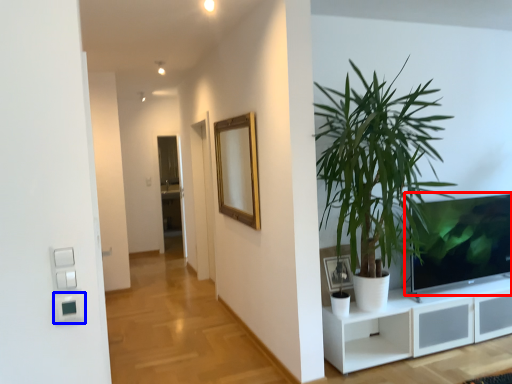
Question: Which object appears farthest to the camera in this image, television (highlighted by a red box) or light switch (highlighted by a blue box)?

Choices:
 (A) television
 (B) light switch

Answer: (A)